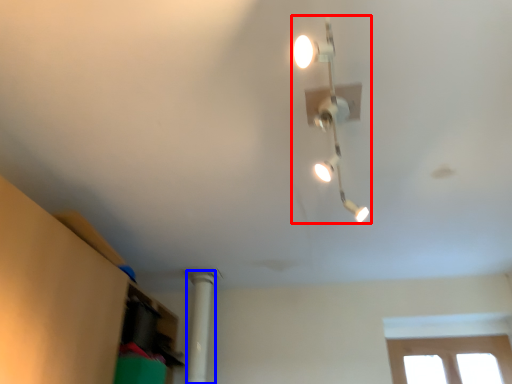
Question: Which of the following is the farthest to the observer, lamp (highlighted by a red box) or pillar (highlighted by a blue box)?

Choices:
 (A) lamp
 (B) pillar

Answer: (B)